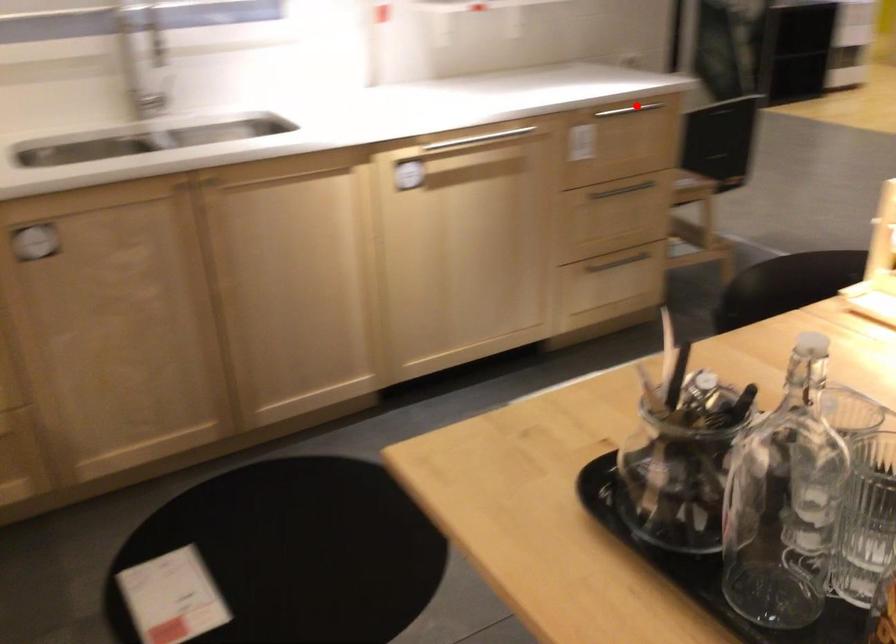
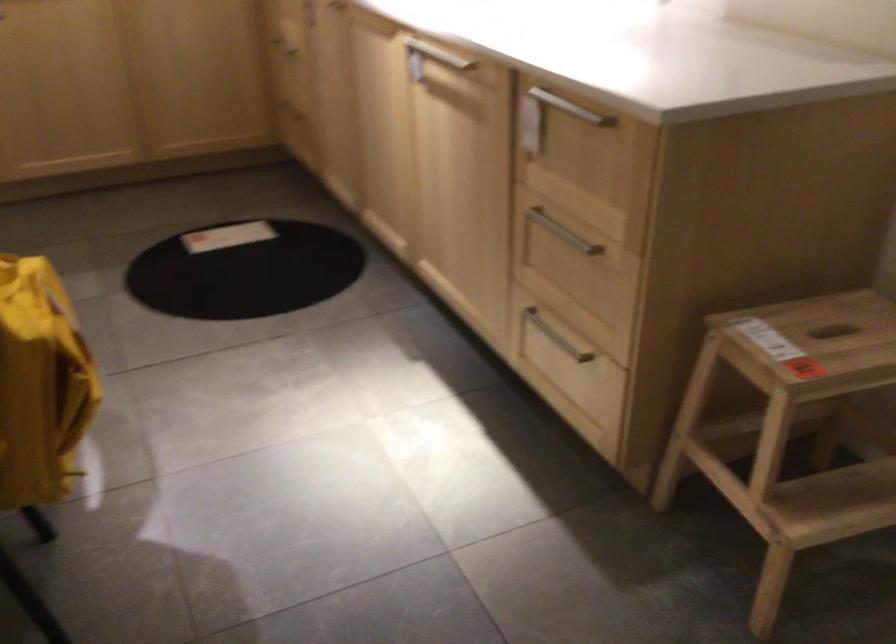
Question: I am providing you with two images of the same scene from different viewpoints. Given a red point in image1, look at the same physical point in image2. Is it:

Choices:
 (A) Closer to the viewpoint
 (B) Farther from the viewpoint

Answer: (A)